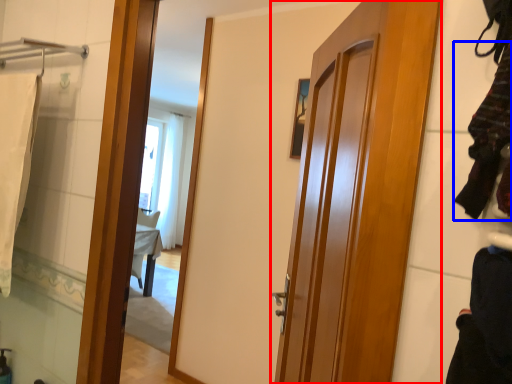
Question: Among these objects, which one is nearest to the camera, door (highlighted by a red box) or clothing (highlighted by a blue box)?

Choices:
 (A) door
 (B) clothing

Answer: (B)